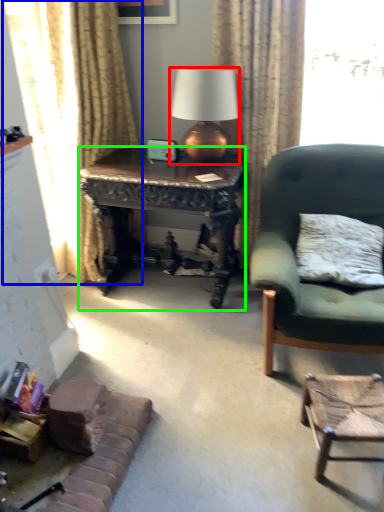
Question: Estimate the real-world distances between objects in this image. Which object is closer to lamp (highlighted by a red box), curtain (highlighted by a blue box) or desk (highlighted by a green box)?

Choices:
 (A) curtain
 (B) desk

Answer: (B)